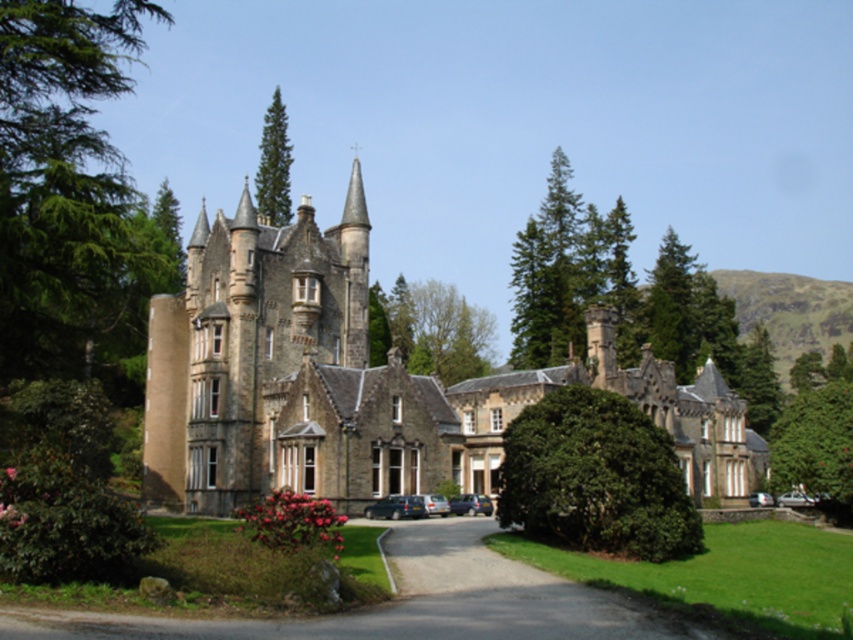
Question: Can you confirm if metallic silver car at lower right is wider than silver metallic car at lower right?

Choices:
 (A) no
 (B) yes

Answer: (B)

Question: Which point is farther from the camera taking this photo?

Choices:
 (A) (773, 502)
 (B) (412, 348)
 (C) (419, 515)

Answer: (B)

Question: Which of the following is the farthest from the observer?

Choices:
 (A) metallic silver car at center
 (B) brown stone castle at center
 (C) green leafy tree at lower right
 (D) green leafy bush at center

Answer: (C)

Question: Can you confirm if green leafy tree at lower right is wider than metallic silver car at center?

Choices:
 (A) no
 (B) yes

Answer: (B)

Question: Can you confirm if green leafy tree at lower right is wider than green coniferous tree at upper center?

Choices:
 (A) yes
 (B) no

Answer: (A)

Question: Which object is closer to the camera taking this photo?

Choices:
 (A) brown stone castle at center
 (B) green leafy tree at center
 (C) metallic silver car at lower right

Answer: (A)